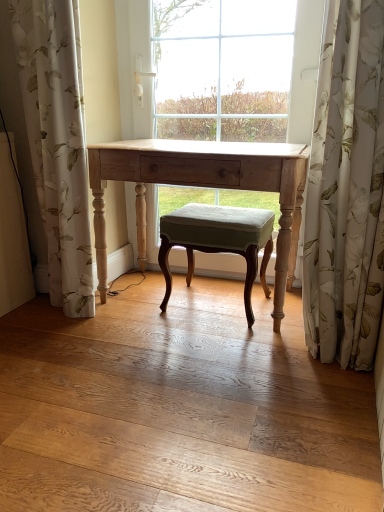
This screenshot has width=384, height=512. I want to click on free space in front of white floral fabric at left, positioned as the second curtain in right-to-left order, so click(x=57, y=333).